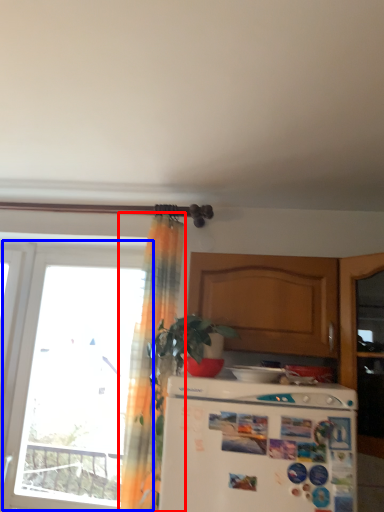
Question: Which object is further to the camera taking this photo, curtain (highlighted by a red box) or window (highlighted by a blue box)?

Choices:
 (A) curtain
 (B) window

Answer: (B)